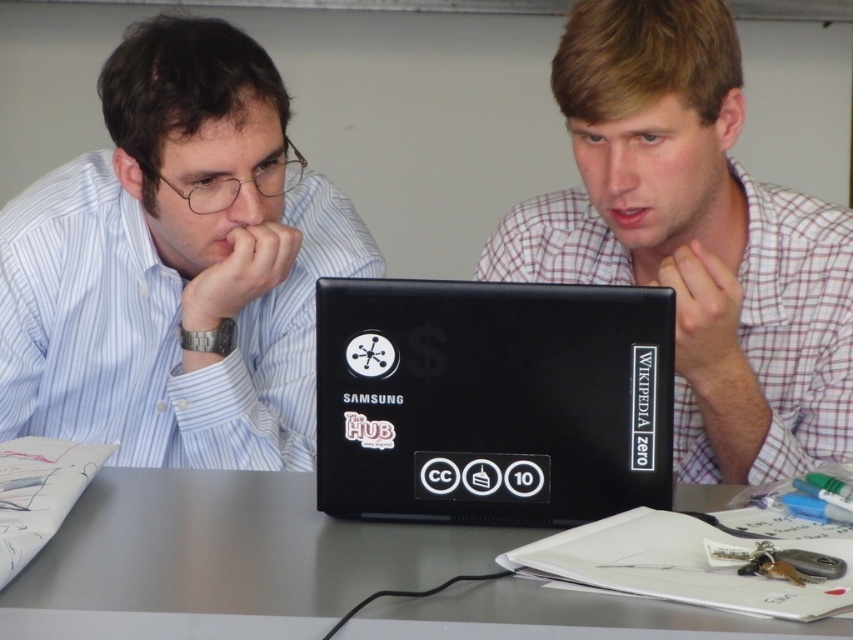
You are a fashion designer observing two shirts in an image. The first is a matte black shirt at left and the second is a plaid shirt at center. Which shirt has a greater width?

The matte black shirt at left has a greater width than the plaid shirt at center according to the description.

You are a photographer standing behind the two people at the table. You want to take a photo that includes both the plaid shirt at center and the black matte laptop at center. Which object will appear closer to the camera in the photo?

The plaid shirt at center is further to the viewer than the black matte laptop at center, so the plaid shirt at center will appear closer to the camera in the photo.